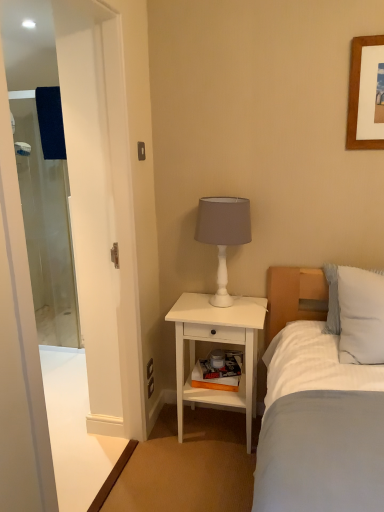
Question: Is white matte table lamp at upper right turned away from white striped pillow at right?

Choices:
 (A) no
 (B) yes

Answer: (A)

Question: Is white matte table lamp at upper right not inside white striped pillow at right?

Choices:
 (A) no
 (B) yes

Answer: (B)

Question: Does white matte table lamp at upper right come behind white striped pillow at right?

Choices:
 (A) yes
 (B) no

Answer: (A)

Question: Could white striped pillow at right be considered to be inside white matte table lamp at upper right?

Choices:
 (A) no
 (B) yes

Answer: (A)

Question: Does white matte table lamp at upper right have a lesser height compared to white striped pillow at right?

Choices:
 (A) no
 (B) yes

Answer: (A)

Question: Can you confirm if white matte table lamp at upper right is bigger than white striped pillow at right?

Choices:
 (A) yes
 (B) no

Answer: (A)

Question: Is white striped pillow at right surrounded by clear glass screen door at left, which ranks as the 1th screen door in left-to-right order?

Choices:
 (A) no
 (B) yes

Answer: (A)

Question: Considering the relative sizes of clear glass screen door at left, which ranks as the 1th screen door in left-to-right order, and white striped pillow at right in the image provided, is clear glass screen door at left, which ranks as the 1th screen door in left-to-right order, bigger than white striped pillow at right?

Choices:
 (A) yes
 (B) no

Answer: (A)

Question: From the image's perspective, is clear glass screen door at left, the 2th screen door in the right-to-left sequence, under white striped pillow at right?

Choices:
 (A) yes
 (B) no

Answer: (B)

Question: Does clear glass screen door at left, the 2th screen door in the right-to-left sequence, appear on the left side of white striped pillow at right?

Choices:
 (A) yes
 (B) no

Answer: (A)

Question: Is clear glass screen door at left, arranged as the 1th screen door when viewed from the back, facing away from white striped pillow at right?

Choices:
 (A) yes
 (B) no

Answer: (B)

Question: From a real-world perspective, is clear glass screen door at left, arranged as the 1th screen door when viewed from the back, located higher than white striped pillow at right?

Choices:
 (A) no
 (B) yes

Answer: (B)

Question: Is white striped pillow at right looking in the opposite direction of white matte table lamp at upper right?

Choices:
 (A) yes
 (B) no

Answer: (B)